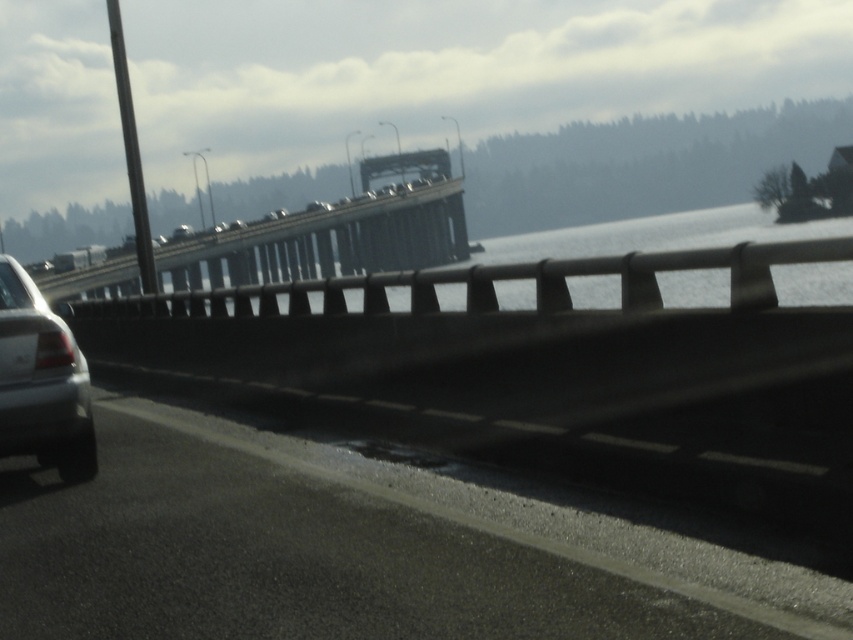
Does metallic gray bridge at upper center appear over satin silver sedan at left?

Indeed, metallic gray bridge at upper center is positioned over satin silver sedan at left.

In the scene shown: Does metallic gray bridge at upper center appear on the left side of satin silver sedan at left?

Yes, metallic gray bridge at upper center is to the left of satin silver sedan at left.

Between point (421, 237) and point (64, 342), which one is positioned behind?

Point (421, 237)

Where is `metallic gray bridge at upper center`? The image size is (853, 640). metallic gray bridge at upper center is located at coordinates (334, 234).